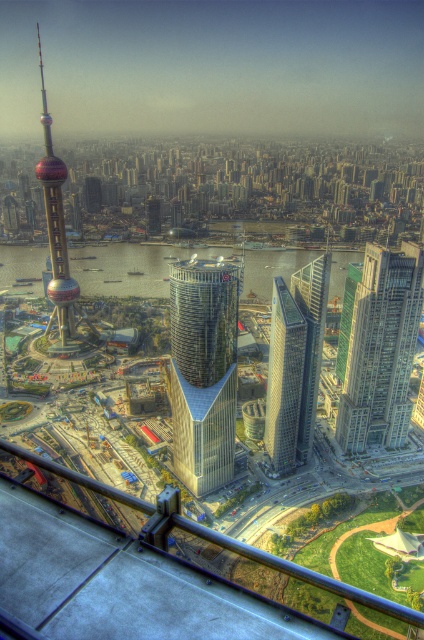
Does glassy silver skyscraper at center have a lesser height compared to green glass skyscraper at center-right?

In fact, glassy silver skyscraper at center may be taller than green glass skyscraper at center-right.

Can you confirm if glassy silver skyscraper at center is positioned below green glass skyscraper at center-right?

Yes, glassy silver skyscraper at center is below green glass skyscraper at center-right.

What do you see at coordinates (203, 371) in the screenshot?
I see `glassy silver skyscraper at center` at bounding box center [203, 371].

The height and width of the screenshot is (640, 424). In order to click on glassy silver skyscraper at center in this screenshot , I will do `click(203, 371)`.

The height and width of the screenshot is (640, 424). What do you see at coordinates (284, 380) in the screenshot?
I see `glassy steel skyscraper at center` at bounding box center [284, 380].

Find the location of a particular element. This screenshot has width=424, height=640. glassy steel skyscraper at center is located at coordinates (284, 380).

The image size is (424, 640). In order to click on glassy steel skyscraper at center in this screenshot , I will do click(284, 380).

Does point (365, 246) come in front of point (50, 280)?

That is False.

Does green glass skyscraper at center-right have a smaller size compared to shiny glass tower at left?

Yes.

Locate an element on the screen. This screenshot has width=424, height=640. green glass skyscraper at center-right is located at coordinates (381, 349).

I want to click on green glass skyscraper at center-right, so click(381, 349).